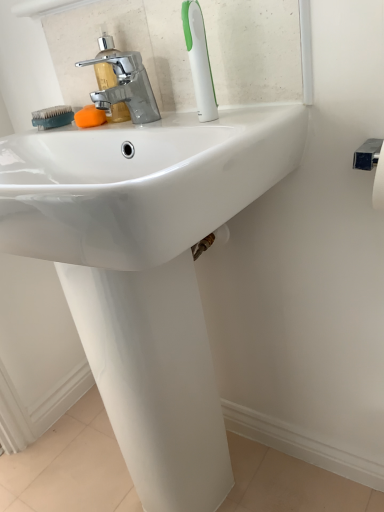
Image resolution: width=384 pixels, height=512 pixels. In order to click on white plastic toothbrush at upper center in this screenshot , I will do `click(199, 60)`.

What do you see at coordinates (52, 117) in the screenshot? I see `teal rubber brush at left` at bounding box center [52, 117].

What do you see at coordinates (90, 117) in the screenshot? I see `orange sponge at center` at bounding box center [90, 117].

What do you see at coordinates (122, 84) in the screenshot? Image resolution: width=384 pixels, height=512 pixels. I see `chrome metallic faucet at upper left` at bounding box center [122, 84].

Locate an element on the screen. white plastic toothbrush at upper center is located at coordinates (199, 60).

You are a GUI agent. You are given a task and a screenshot of the screen. Output one action in this format:
    pyautogui.click(x=<x>, y=<y>)
    Task: Click on the toothbrush positioned vertically above the teal rubber brush at left (from a real-world perspective)
    
    Given the screenshot: What is the action you would take?
    pyautogui.click(x=199, y=60)

Is white plastic toothbrush at upper center inside teal rubber brush at left?

That's incorrect, white plastic toothbrush at upper center is not inside teal rubber brush at left.

From the image's perspective, is teal rubber brush at left above white plastic toothbrush at upper center?

Actually, teal rubber brush at left appears below white plastic toothbrush at upper center in the image.

From the picture: From a real-world perspective, which object rests below the other?

teal rubber brush at left, from a real-world perspective.

Is teal rubber brush at left inside or outside of chrome metallic faucet at upper left?

teal rubber brush at left lies outside chrome metallic faucet at upper left.

Is teal rubber brush at left in front of or behind chrome metallic faucet at upper left in the image?

teal rubber brush at left is positioned farther from the viewer than chrome metallic faucet at upper left.

Is teal rubber brush at left oriented towards chrome metallic faucet at upper left?

No, teal rubber brush at left is not turned towards chrome metallic faucet at upper left.

From the image's perspective, is teal rubber brush at left on chrome metallic faucet at upper left?

Incorrect, from the image's perspective, teal rubber brush at left is lower than chrome metallic faucet at upper left.

Who is taller, chrome metallic faucet at upper left or orange sponge at center?

Standing taller between the two is chrome metallic faucet at upper left.

Considering the positions of objects chrome metallic faucet at upper left and orange sponge at center in the image provided, who is more to the right, chrome metallic faucet at upper left or orange sponge at center?

chrome metallic faucet at upper left.

Considering the relative sizes of chrome metallic faucet at upper left and orange sponge at center in the image provided, is chrome metallic faucet at upper left thinner than orange sponge at center?

Yes, chrome metallic faucet at upper left is thinner than orange sponge at center.

Is white plastic toothbrush at upper center wider than teal rubber brush at left?

In fact, white plastic toothbrush at upper center might be narrower than teal rubber brush at left.

Which object is further away from the camera taking this photo, white plastic toothbrush at upper center or teal rubber brush at left?

teal rubber brush at left is further away from the camera.

Can you confirm if white plastic toothbrush at upper center is shorter than teal rubber brush at left?

No, white plastic toothbrush at upper center is not shorter than teal rubber brush at left.

Based on the photo, which object is positioned more to the right, white plastic toothbrush at upper center or teal rubber brush at left?

Positioned to the right is white plastic toothbrush at upper center.

Considering the points (78, 121) and (139, 56), which point is in front, point (78, 121) or point (139, 56)?

The point (139, 56) is closer.

Is chrome metallic faucet at upper left at the back of orange sponge at center?

No, orange sponge at center is not facing the opposite direction of chrome metallic faucet at upper left.

Would you say orange sponge at center is outside chrome metallic faucet at upper left?

Yes, orange sponge at center is outside of chrome metallic faucet at upper left.

Which object is wider, orange sponge at center or chrome metallic faucet at upper left?

Wider between the two is orange sponge at center.

Is white plastic toothbrush at upper center smaller than chrome metallic faucet at upper left?

Yes.

From a real-world perspective, is white plastic toothbrush at upper center physically located above or below chrome metallic faucet at upper left?

In terms of real-world spatial position, white plastic toothbrush at upper center is above chrome metallic faucet at upper left.

Between white plastic toothbrush at upper center and chrome metallic faucet at upper left, which one is positioned in front?

white plastic toothbrush at upper center.

Locate an element on the screen. soap on the left of white plastic toothbrush at upper center is located at coordinates (90, 117).

Is white plastic toothbrush at upper center oriented away from orange sponge at center?

No, orange sponge at center is not at the back of white plastic toothbrush at upper center.

Can orange sponge at center be found inside white plastic toothbrush at upper center?

No, white plastic toothbrush at upper center does not contain orange sponge at center.

In order to click on toothbrush that is above the teal rubber brush at left (from a real-world perspective) in this screenshot , I will do `click(199, 60)`.

Where is `brush located underneath the chrome metallic faucet at upper left (from a real-world perspective)`? The image size is (384, 512). brush located underneath the chrome metallic faucet at upper left (from a real-world perspective) is located at coordinates (52, 117).

From the image, which object appears to be farther from chrome metallic faucet at upper left, orange sponge at center or teal rubber brush at left?

Among the two, teal rubber brush at left is located further to chrome metallic faucet at upper left.

When comparing their distances from teal rubber brush at left, does white plastic toothbrush at upper center or chrome metallic faucet at upper left seem further?

The object further to teal rubber brush at left is white plastic toothbrush at upper center.

Looking at the image, which one is located further to orange sponge at center, teal rubber brush at left or chrome metallic faucet at upper left?

The object further to orange sponge at center is teal rubber brush at left.

In the scene shown: Based on their spatial positions, is orange sponge at center or chrome metallic faucet at upper left closer to white plastic toothbrush at upper center?

chrome metallic faucet at upper left is closer to white plastic toothbrush at upper center.

Which object lies nearer to the anchor point white plastic toothbrush at upper center, orange sponge at center or teal rubber brush at left?

Based on the image, orange sponge at center appears to be nearer to white plastic toothbrush at upper center.

Which object lies nearer to the anchor point chrome metallic faucet at upper left, white plastic toothbrush at upper center or teal rubber brush at left?

Among the two, teal rubber brush at left is located nearer to chrome metallic faucet at upper left.

Looking at the image, which one is located closer to teal rubber brush at left, orange sponge at center or chrome metallic faucet at upper left?

orange sponge at center is closer to teal rubber brush at left.

From the image, which object appears to be nearer to teal rubber brush at left, orange sponge at center or white plastic toothbrush at upper center?

orange sponge at center is positioned closer to the anchor teal rubber brush at left.

Locate an element on the screen. This screenshot has width=384, height=512. soap between white plastic toothbrush at upper center and teal rubber brush at left along the z-axis is located at coordinates (90, 117).

Identify the location of tap between white plastic toothbrush at upper center and teal rubber brush at left along the z-axis. This screenshot has height=512, width=384. (122, 84).

I want to click on soap between teal rubber brush at left and chrome metallic faucet at upper left in the horizontal direction, so click(90, 117).

This screenshot has height=512, width=384. I want to click on tap located between white plastic toothbrush at upper center and orange sponge at center in the depth direction, so click(122, 84).